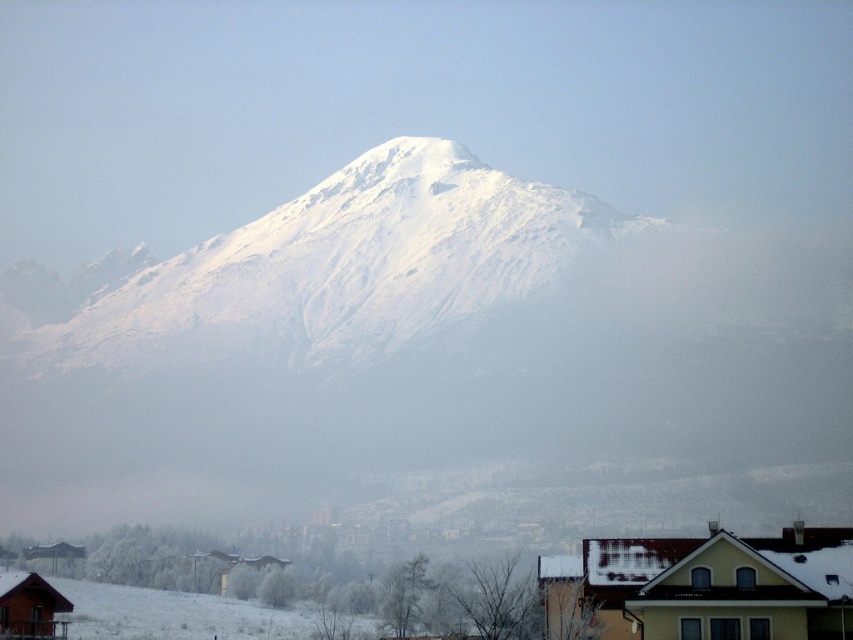
Consider the image. Is yellow matte house at lower right thinner than wooden cabin at lower left?

No, yellow matte house at lower right is not thinner than wooden cabin at lower left.

Is yellow matte house at lower right behind wooden cabin at lower left?

No, yellow matte house at lower right is in front of wooden cabin at lower left.

Does point (566, 627) come farther from viewer compared to point (22, 586)?

No, (566, 627) is closer to viewer.

Where is `yellow matte house at lower right`? yellow matte house at lower right is located at coordinates (703, 586).